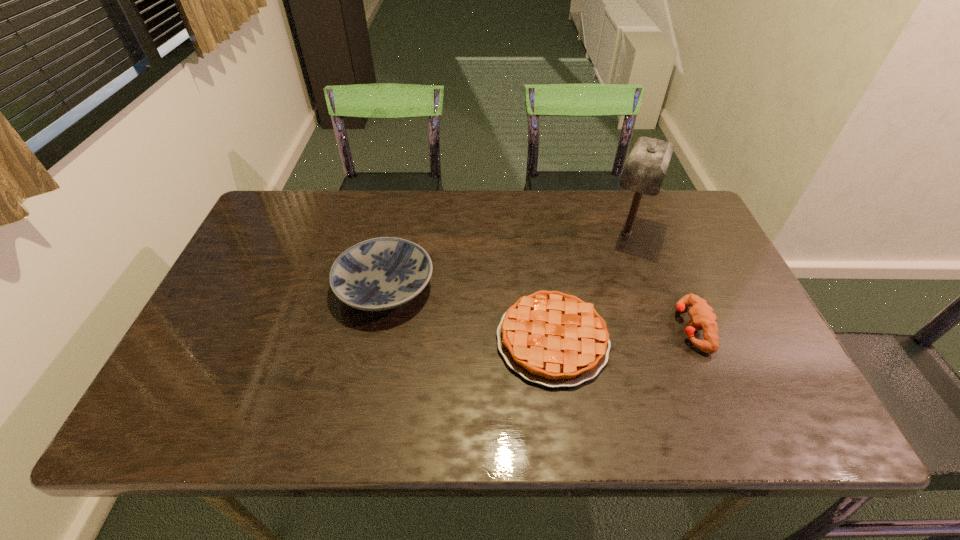
Where is `free area in between the pie and the mallet`? The image size is (960, 540). free area in between the pie and the mallet is located at coordinates (589, 287).

Where is `free spot between the mallet and the pie`? The height and width of the screenshot is (540, 960). free spot between the mallet and the pie is located at coordinates (589, 287).

The width and height of the screenshot is (960, 540). Find the location of `unoccupied position between the tallest object and the plate`. unoccupied position between the tallest object and the plate is located at coordinates (506, 260).

I want to click on free space between the mallet and the second object from left to right, so click(589, 287).

Where is `free space between the pie and the mallet`? free space between the pie and the mallet is located at coordinates (589, 287).

The height and width of the screenshot is (540, 960). What are the coordinates of `free space between the puncher and the second object from left to right` in the screenshot? It's located at (622, 334).

This screenshot has width=960, height=540. I want to click on free space between the leftmost object and the tallest object, so click(506, 260).

I want to click on free space that is in between the tallest object and the pie, so click(589, 287).

The width and height of the screenshot is (960, 540). Find the location of `empty space between the tallest object and the second object from left to right`. empty space between the tallest object and the second object from left to right is located at coordinates (589, 287).

Where is `object that is the closest one to the tallest object`? Image resolution: width=960 pixels, height=540 pixels. object that is the closest one to the tallest object is located at coordinates (554, 339).